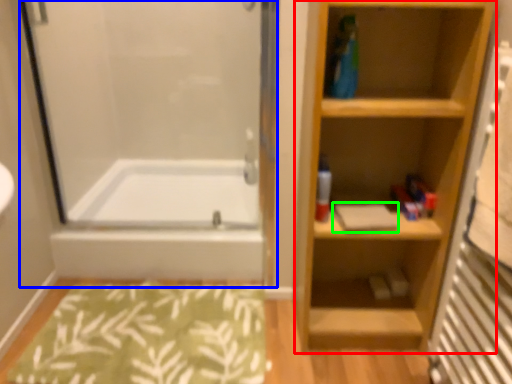
Question: Which object is the closest to the bookshelf (highlighted by a red box)? Choose among these: screen door (highlighted by a blue box) or book (highlighted by a green box).

Choices:
 (A) screen door
 (B) book

Answer: (B)